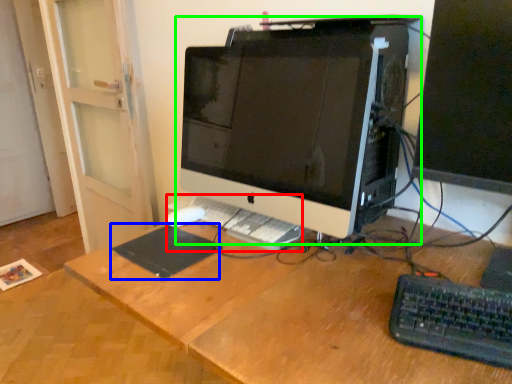
Question: Estimate the real-world distances between objects in this image. Which object is farther from laptop keyboard (highlighted by a red box), mousepad (highlighted by a blue box) or computer monitor (highlighted by a green box)?

Choices:
 (A) mousepad
 (B) computer monitor

Answer: (B)